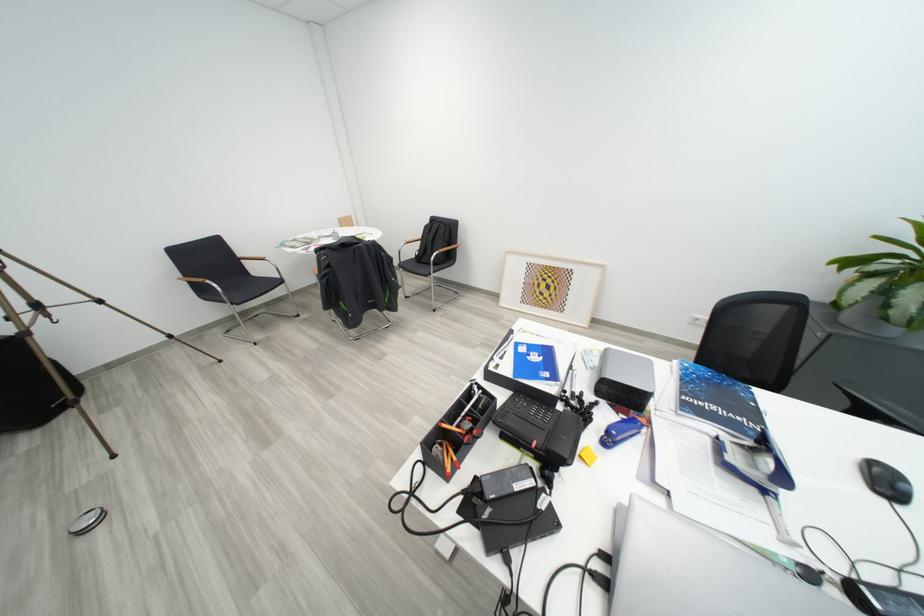
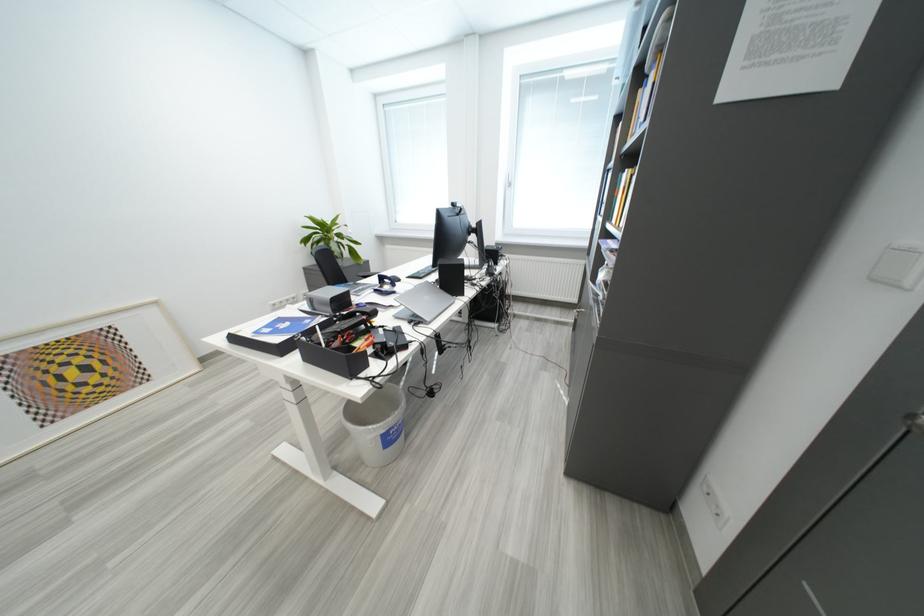
Locate, in the second image, the point that corresponds to (x=735, y=440) in the first image.

(384, 291)